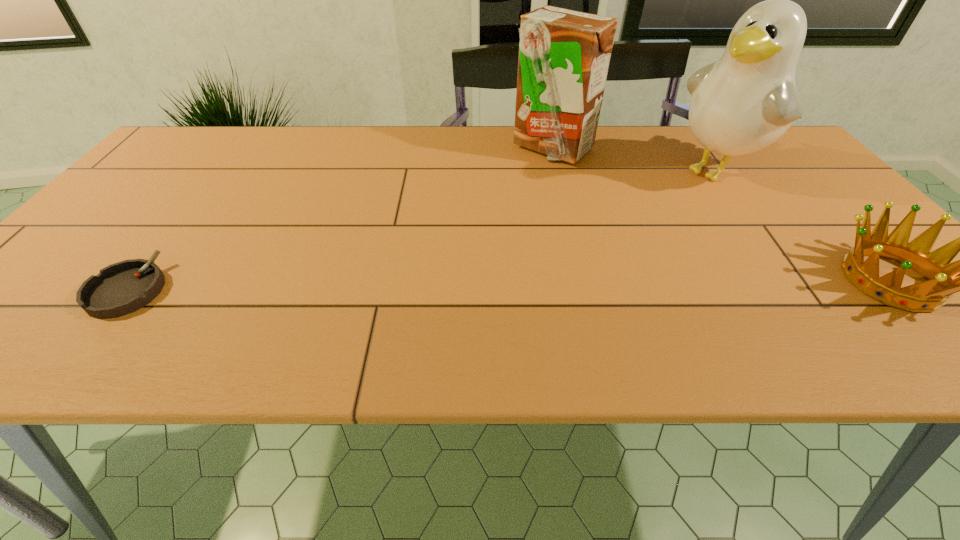
Locate an element on the screen. the shortest object is located at coordinates (124, 287).

At what (x,y) coordinates should I click in order to perform the action: click on the leftmost object. Please return your answer as a coordinate pair (x, y). Looking at the image, I should click on (124, 287).

Find the location of a particular element. the second tallest object is located at coordinates (564, 55).

What are the coordinates of `carton` in the screenshot? It's located at (564, 55).

The height and width of the screenshot is (540, 960). In order to click on the tallest object in this screenshot , I will do `click(742, 103)`.

The image size is (960, 540). I want to click on vacant region located 0.210m on the right of the ashtray, so click(x=268, y=289).

Where is `free space located on the straw side of the second tallest object`? The width and height of the screenshot is (960, 540). free space located on the straw side of the second tallest object is located at coordinates (592, 245).

At what (x,y) coordinates should I click in order to perform the action: click on free region located on the straw side of the second tallest object. Please return your answer as a coordinate pair (x, y). Looking at the image, I should click on (596, 254).

Where is `blank space located 0.150m on the straw side of the second tallest object`? The image size is (960, 540). blank space located 0.150m on the straw side of the second tallest object is located at coordinates (573, 200).

Find the location of a particular element. Image resolution: width=960 pixels, height=540 pixels. free space located 0.200m on the beak of the tallest object is located at coordinates click(x=637, y=219).